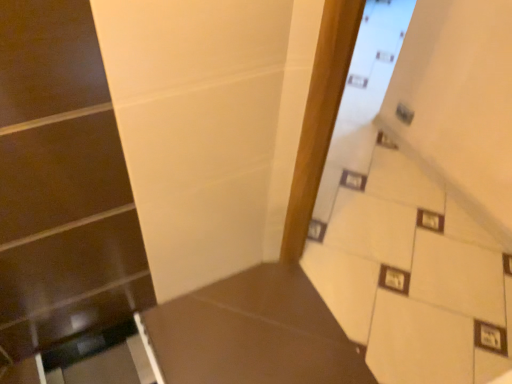
Question: Is white tile stairwell at upper right wider than brown matte table at lower left?

Choices:
 (A) yes
 (B) no

Answer: (B)

Question: Considering the relative sizes of white tile stairwell at upper right and brown matte table at lower left in the image provided, is white tile stairwell at upper right thinner than brown matte table at lower left?

Choices:
 (A) yes
 (B) no

Answer: (A)

Question: Is white tile stairwell at upper right in front of brown matte table at lower left?

Choices:
 (A) yes
 (B) no

Answer: (A)

Question: Is white tile stairwell at upper right to the left of brown matte table at lower left from the viewer's perspective?

Choices:
 (A) yes
 (B) no

Answer: (B)

Question: Considering the relative sizes of white tile stairwell at upper right and brown matte table at lower left in the image provided, is white tile stairwell at upper right smaller than brown matte table at lower left?

Choices:
 (A) yes
 (B) no

Answer: (B)

Question: Is white tile stairwell at upper right at the right side of brown matte table at lower left?

Choices:
 (A) yes
 (B) no

Answer: (A)

Question: Is brown matte table at lower left surrounding white tile stairwell at upper right?

Choices:
 (A) no
 (B) yes

Answer: (A)

Question: Is brown matte table at lower left bigger than white tile stairwell at upper right?

Choices:
 (A) yes
 (B) no

Answer: (B)

Question: Is brown matte table at lower left not within white tile stairwell at upper right?

Choices:
 (A) no
 (B) yes

Answer: (B)

Question: Is brown matte table at lower left not near white tile stairwell at upper right?

Choices:
 (A) yes
 (B) no

Answer: (B)

Question: Is brown matte table at lower left shorter than white tile stairwell at upper right?

Choices:
 (A) no
 (B) yes

Answer: (B)

Question: Could you tell me if brown matte table at lower left is facing white tile stairwell at upper right?

Choices:
 (A) no
 (B) yes

Answer: (B)

Question: From the image's perspective, is brown matte table at lower left located above or below white tile stairwell at upper right?

Choices:
 (A) above
 (B) below

Answer: (B)